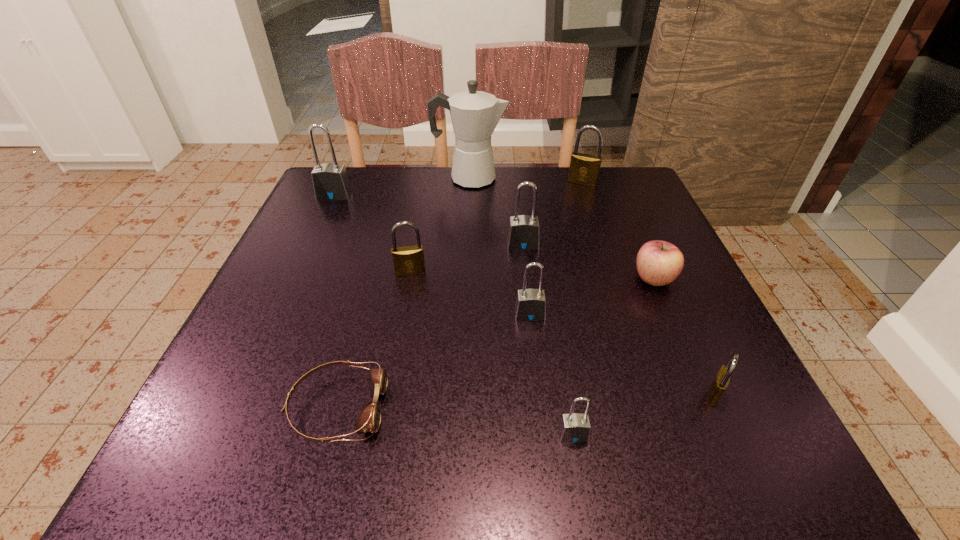
In order to click on gray coffeepot in this screenshot , I will do `click(475, 114)`.

I want to click on the tallest object, so click(x=475, y=114).

At what (x,y) coordinates should I click in order to perform the action: click on the leftmost padlock. Please return your answer as a coordinate pair (x, y). The height and width of the screenshot is (540, 960). Looking at the image, I should click on (330, 181).

Where is `the second farthest padlock`? This screenshot has width=960, height=540. the second farthest padlock is located at coordinates (330, 181).

Identify the location of the biggest brass padlock. (584, 169).

Locate an element on the screen. The width and height of the screenshot is (960, 540). the farthest brass padlock is located at coordinates (584, 169).

Locate an element on the screen. The width and height of the screenshot is (960, 540). the third nearest gray padlock is located at coordinates (523, 234).

Where is `the seventh nearest object`? the seventh nearest object is located at coordinates (523, 234).

At what (x,y) coordinates should I click in order to perform the action: click on the fourth nearest object. Please return your answer as a coordinate pair (x, y). This screenshot has height=540, width=960. Looking at the image, I should click on 530,305.

At what (x,y) coordinates should I click in order to perform the action: click on the third biggest gray padlock. Please return your answer as a coordinate pair (x, y). This screenshot has width=960, height=540. Looking at the image, I should click on (530, 305).